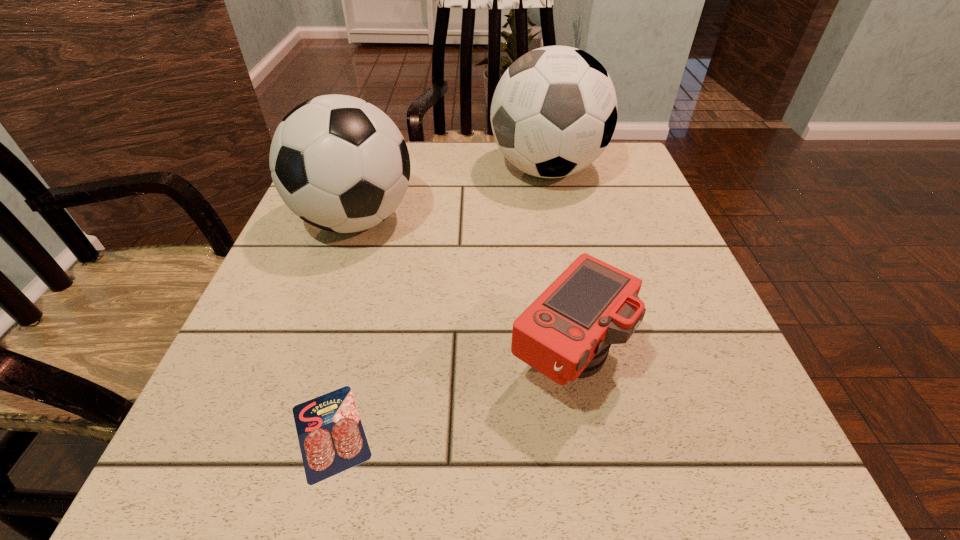
The height and width of the screenshot is (540, 960). Find the location of `object positioned at the near edge`. object positioned at the near edge is located at coordinates pyautogui.click(x=331, y=436).

At what (x,y) coordinates should I click in order to perform the action: click on soccer ball that is at the left edge. Please return your answer as a coordinate pair (x, y). Image resolution: width=960 pixels, height=540 pixels. Looking at the image, I should click on (338, 162).

I want to click on salami positioned at the left edge, so click(x=331, y=436).

The image size is (960, 540). I want to click on soccer ball that is at the right edge, so click(554, 111).

Locate an element on the screen. The image size is (960, 540). camera at the right edge is located at coordinates (565, 334).

Locate an element on the screen. This screenshot has height=540, width=960. object at the far left corner is located at coordinates (338, 162).

Identify the location of object that is positioned at the near left corner. (331, 436).

You are a GUI agent. You are given a task and a screenshot of the screen. Output one action in this format:
    pyautogui.click(x=<x>, y=<y>)
    Task: Click on the object that is positioned at the far right corner
    
    Given the screenshot: What is the action you would take?
    click(x=554, y=111)

What are the coordinates of `vacant region at the far edge of the desktop` in the screenshot? It's located at (448, 161).

I want to click on free region at the near edge of the desktop, so click(576, 450).